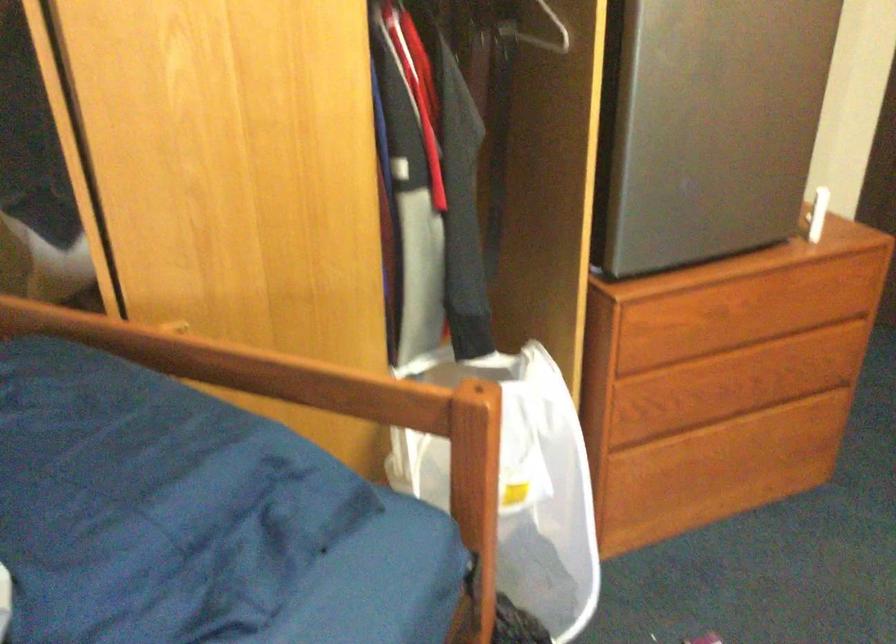
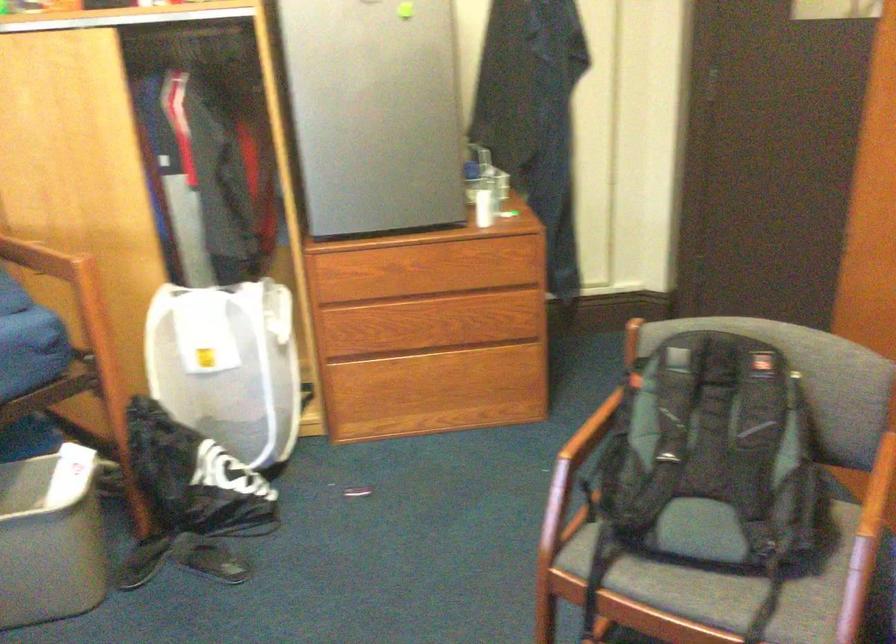
In the second image, find the point that corresponds to point 760,295 in the first image.

(440, 266)